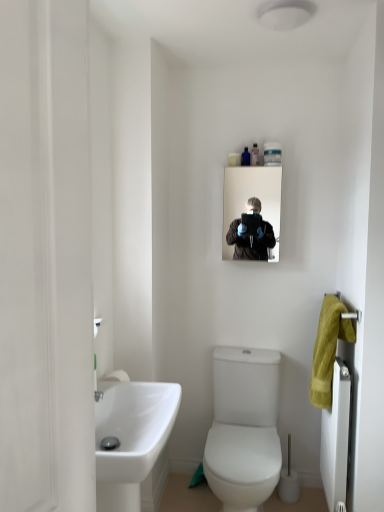
Question: Is white glossy toilet at center oriented away from white glossy sink at lower left?

Choices:
 (A) yes
 (B) no

Answer: (B)

Question: From a real-world perspective, is white glossy toilet at center physically below white glossy sink at lower left?

Choices:
 (A) no
 (B) yes

Answer: (B)

Question: Considering the relative sizes of white glossy toilet at center and white glossy sink at lower left in the image provided, is white glossy toilet at center thinner than white glossy sink at lower left?

Choices:
 (A) yes
 (B) no

Answer: (B)

Question: Does white glossy toilet at center appear on the left side of white glossy sink at lower left?

Choices:
 (A) yes
 (B) no

Answer: (B)

Question: Can you confirm if white glossy toilet at center is bigger than white glossy sink at lower left?

Choices:
 (A) yes
 (B) no

Answer: (A)

Question: Would you say white glossy toilet at center contains white glossy sink at lower left?

Choices:
 (A) no
 (B) yes

Answer: (A)

Question: From the image's perspective, is white textured radiator at right above white matte screen door at left?

Choices:
 (A) yes
 (B) no

Answer: (B)

Question: Is white textured radiator at right surrounding white matte screen door at left?

Choices:
 (A) no
 (B) yes

Answer: (A)

Question: Is white textured radiator at right behind white matte screen door at left?

Choices:
 (A) no
 (B) yes

Answer: (B)

Question: Does white textured radiator at right have a greater height compared to white matte screen door at left?

Choices:
 (A) no
 (B) yes

Answer: (A)

Question: Is white textured radiator at right to the right of white matte screen door at left from the viewer's perspective?

Choices:
 (A) yes
 (B) no

Answer: (A)

Question: From a real-world perspective, is white textured radiator at right located beneath white matte screen door at left?

Choices:
 (A) yes
 (B) no

Answer: (A)

Question: Is white glossy sink at lower left surrounding translucent plastic bottle at upper center, which ranks as the 3th toiletry in right-to-left order?

Choices:
 (A) no
 (B) yes

Answer: (A)